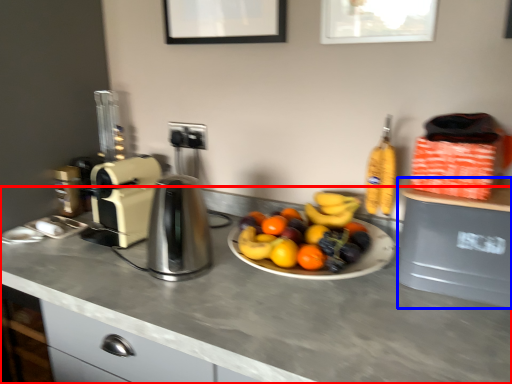
Question: Which object is closer to the camera taking this photo, countertop (highlighted by a red box) or appliance (highlighted by a blue box)?

Choices:
 (A) countertop
 (B) appliance

Answer: (A)